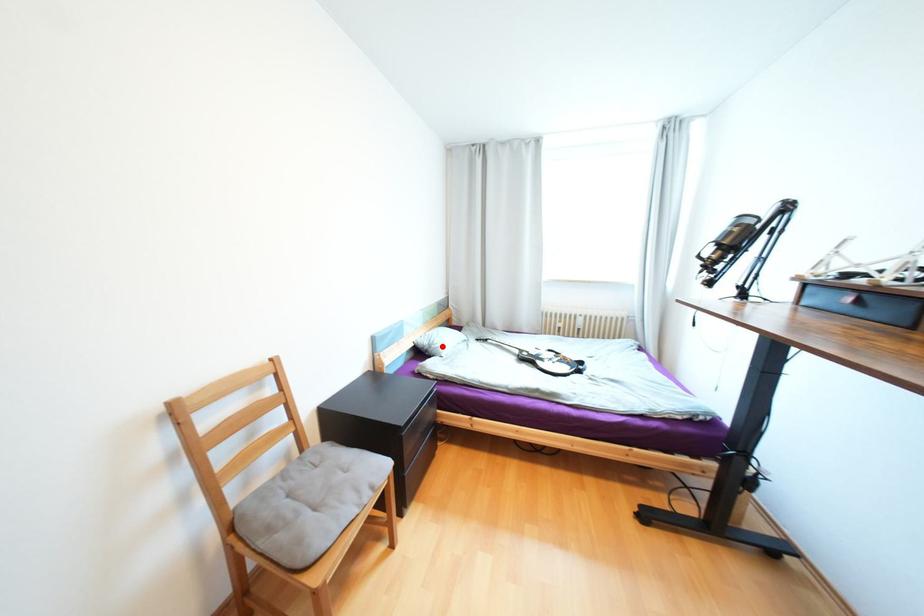
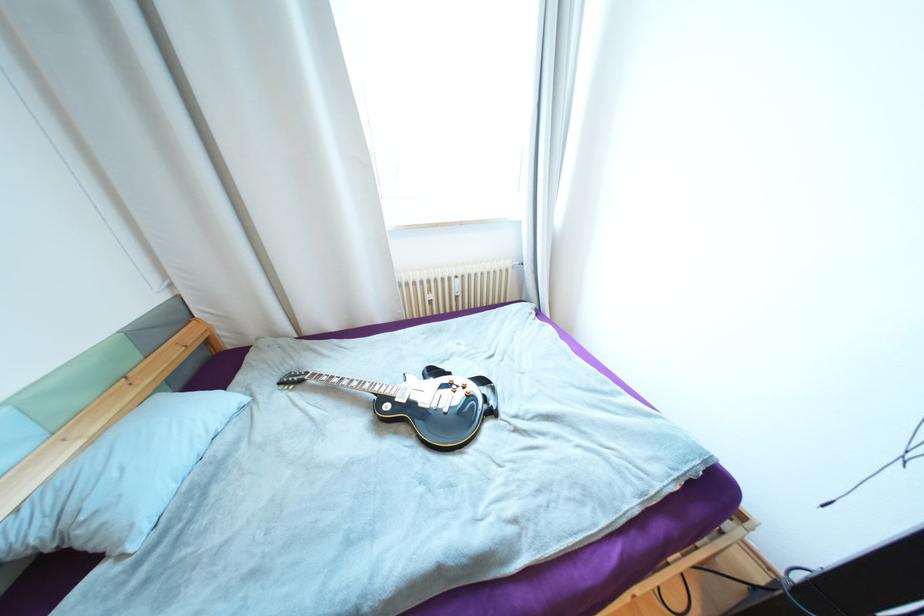
In the second image, find the point that corresponds to the highlighted location in the first image.

(101, 525)